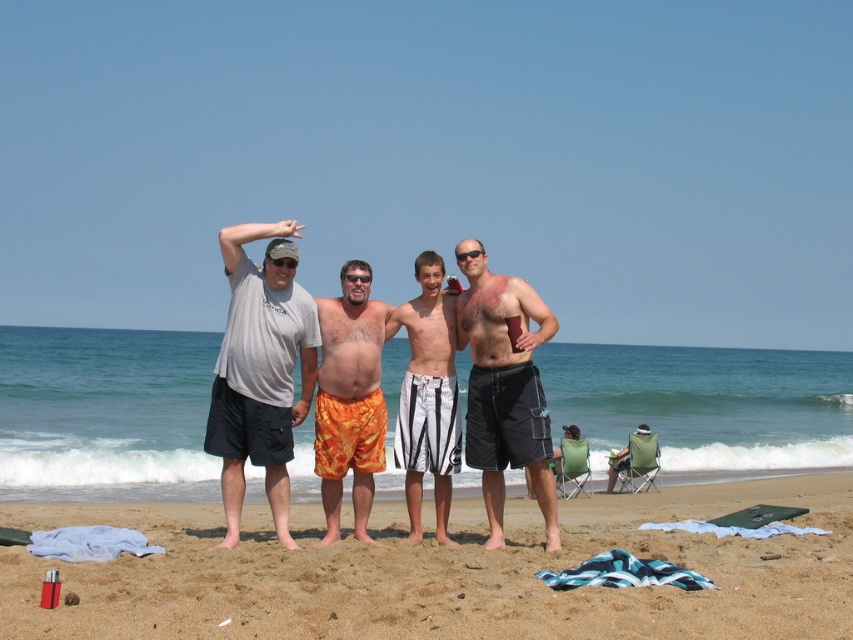
Does gray t-shirt at left appear on the right side of orange printed shorts at center?

In fact, gray t-shirt at left is to the left of orange printed shorts at center.

Is gray t-shirt at left positioned in front of orange printed shorts at center?

Yes, it is.

Describe the element at coordinates (260, 371) in the screenshot. I see `gray t-shirt at left` at that location.

The height and width of the screenshot is (640, 853). In order to click on gray t-shirt at left in this screenshot , I will do `click(260, 371)`.

Does orange printed shorts at center appear on the left side of white striped shorts at center?

Indeed, orange printed shorts at center is positioned on the left side of white striped shorts at center.

Between point (328, 525) and point (437, 264), which one is positioned behind?

Point (437, 264)

What do you see at coordinates (349, 397) in the screenshot? The image size is (853, 640). I see `orange printed shorts at center` at bounding box center [349, 397].

The width and height of the screenshot is (853, 640). I want to click on orange printed shorts at center, so click(x=349, y=397).

Is beige sand at center smaller than orange printed shorts at center?

No, beige sand at center is not smaller than orange printed shorts at center.

Is point (577, 625) closer to viewer compared to point (331, 461)?

Yes.

In order to click on beige sand at center in this screenshot , I will do `click(445, 572)`.

Where is `beige sand at center`? beige sand at center is located at coordinates (445, 572).